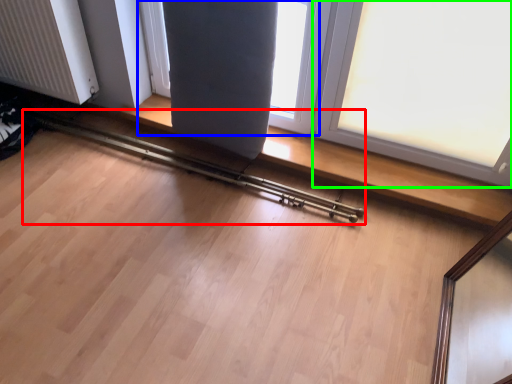
Question: Which is farther away from rail (highlighted by a red box)? window (highlighted by a blue box) or window (highlighted by a green box)?

Choices:
 (A) window
 (B) window

Answer: (B)